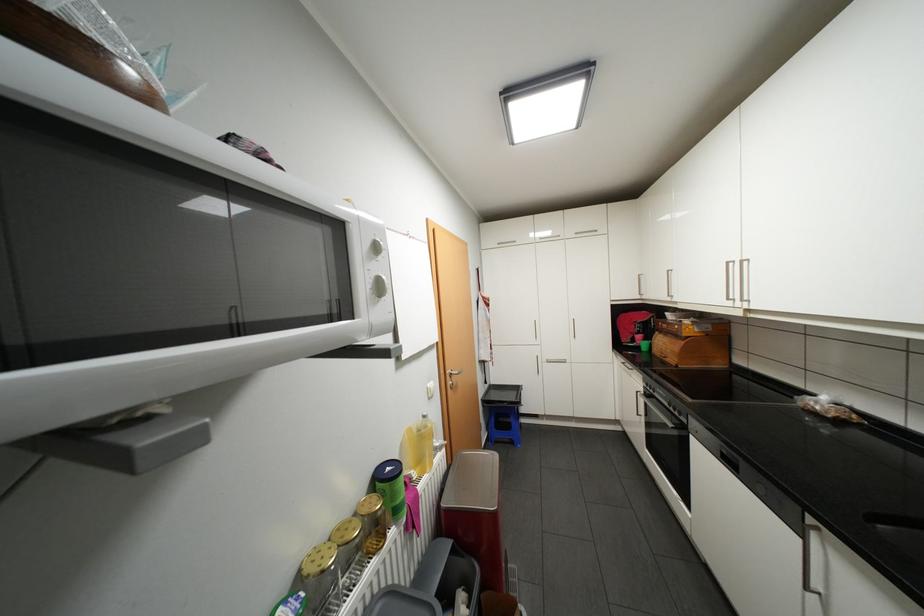
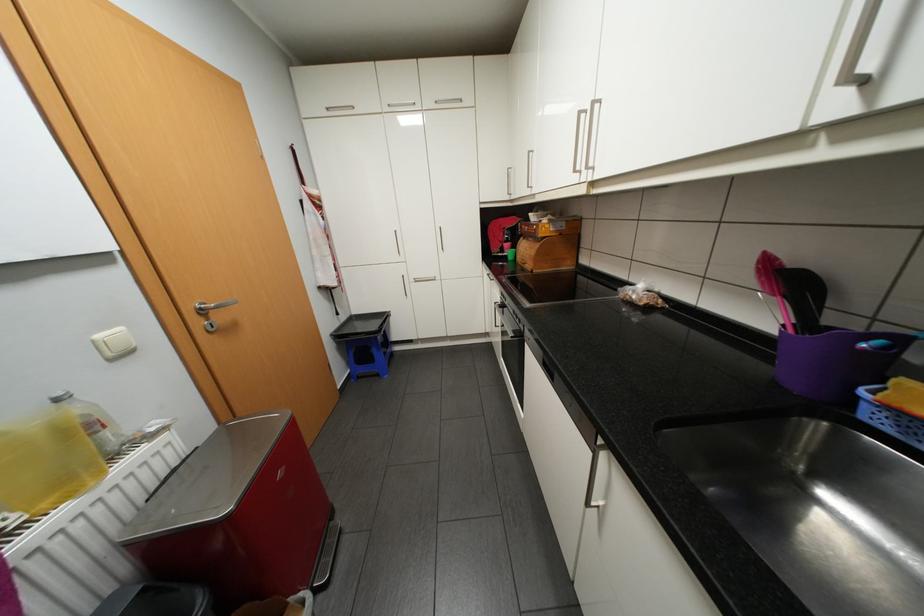
In a continuous first-person perspective shot, in which direction is the camera moving?

The cameraman walked toward right, forward.